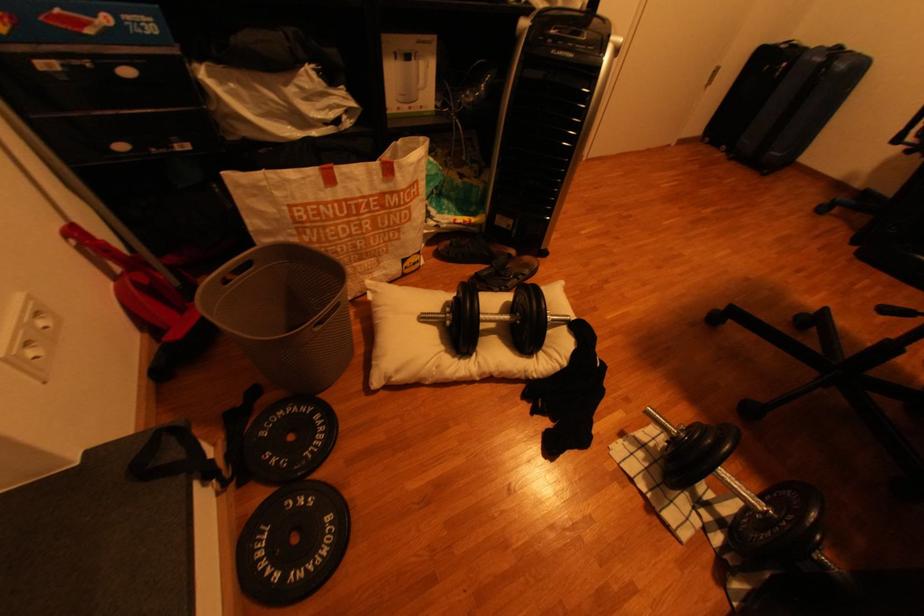
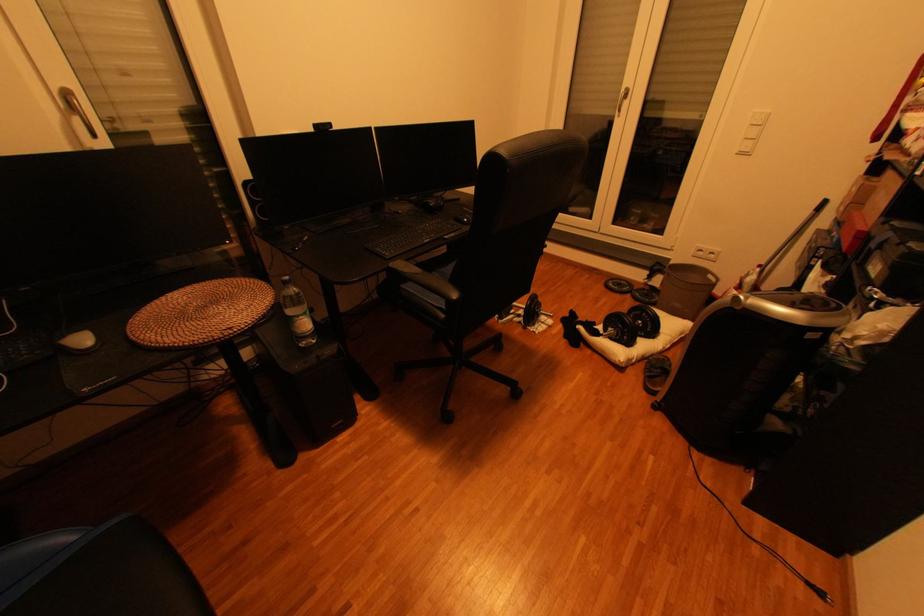
In the second image, find the point that corresponds to [325,419] in the first image.

(658, 301)